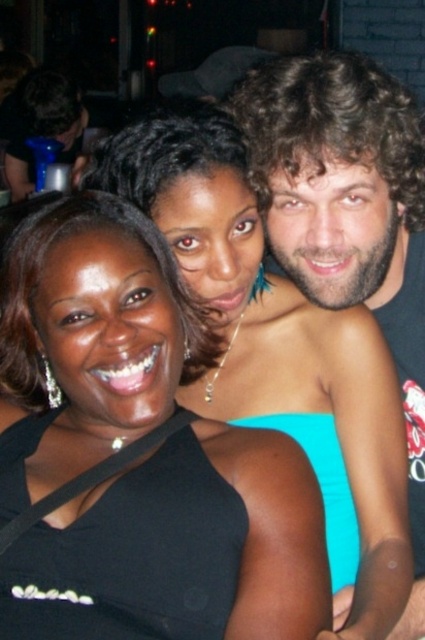
Question: Among these points, which one is farthest from the camera?

Choices:
 (A) (186, 611)
 (B) (19, 486)

Answer: (B)

Question: Can you confirm if curly hair at upper right is smaller than black satin dress at lower left?

Choices:
 (A) yes
 (B) no

Answer: (B)

Question: Which of the following is the closest to the observer?

Choices:
 (A) curly hair at upper right
 (B) teal fabric dress at center
 (C) black satin dress at lower left
 (D) matte black dress at center

Answer: (D)

Question: Can you confirm if curly hair at upper right is wider than teal fabric dress at center?

Choices:
 (A) no
 (B) yes

Answer: (B)

Question: Which point is closer to the camera?

Choices:
 (A) black satin dress at lower left
 (B) teal fabric dress at center
 (C) curly hair at upper right
 (D) matte black dress at center

Answer: (D)

Question: Is matte black dress at center bigger than black satin dress at lower left?

Choices:
 (A) yes
 (B) no

Answer: (A)